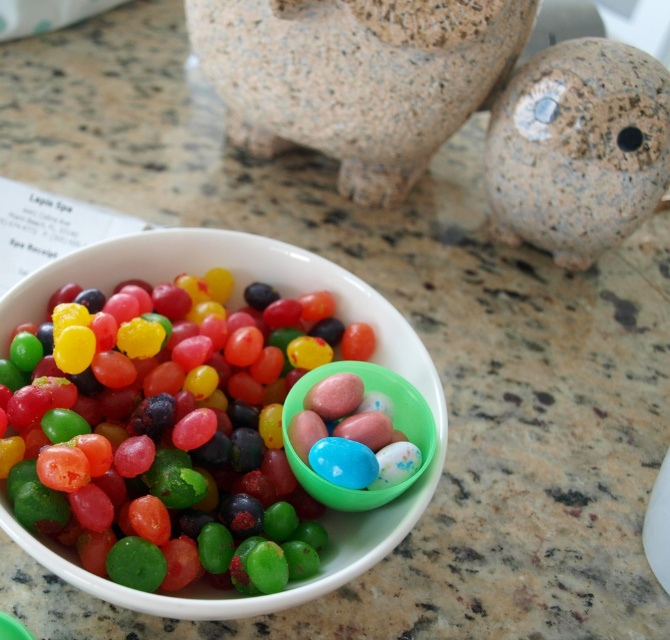
Which is more to the left, glossy jelly beans at center or speckled stone ball at upper right?

glossy jelly beans at center is more to the left.

Can you confirm if glossy jelly beans at center is thinner than speckled stone ball at upper right?

No.

Does point (190, 323) lie in front of point (494, 113)?

That is True.

Locate an element on the screen. This screenshot has width=670, height=640. glossy jelly beans at center is located at coordinates (161, 432).

Does granite piggy bank at upper center appear over speckled stone ball at upper right?

Indeed, granite piggy bank at upper center is positioned over speckled stone ball at upper right.

Is granite piggy bank at upper center wider than speckled stone ball at upper right?

Yes, granite piggy bank at upper center is wider than speckled stone ball at upper right.

Does point (368, 102) come in front of point (596, 200)?

Yes, it is.

Find the location of a particular element. granite piggy bank at upper center is located at coordinates (354, 76).

Who is more forward, [570,76] or [332,481]?

Point [332,481] is in front.

How far apart are speckled stone ball at upper right and translucent plastic eggs at center?

A distance of 58.63 centimeters exists between speckled stone ball at upper right and translucent plastic eggs at center.

Which is behind, point (529, 147) or point (368, 426)?

The point (529, 147) is behind.

Where is `speckled stone ball at upper right`? The height and width of the screenshot is (640, 670). speckled stone ball at upper right is located at coordinates (578, 148).